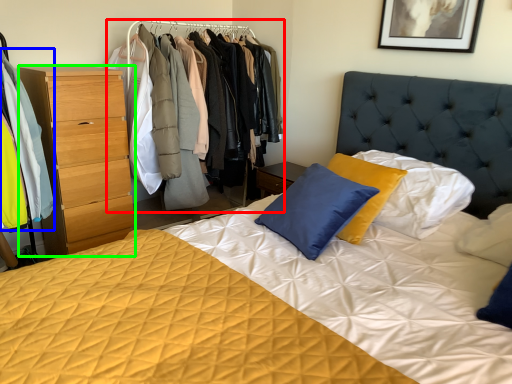
Question: Considering the real-world distances, which object is farthest from dresser (highlighted by a red box)? clothing (highlighted by a blue box) or chest of drawers (highlighted by a green box)?

Choices:
 (A) clothing
 (B) chest of drawers

Answer: (A)